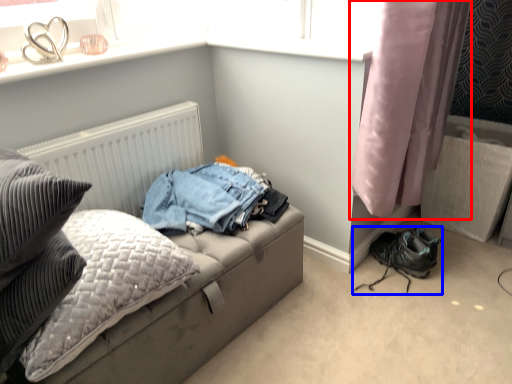
Question: Which point is further to the camera, curtain (highlighted by a red box) or footwear (highlighted by a blue box)?

Choices:
 (A) curtain
 (B) footwear

Answer: (B)